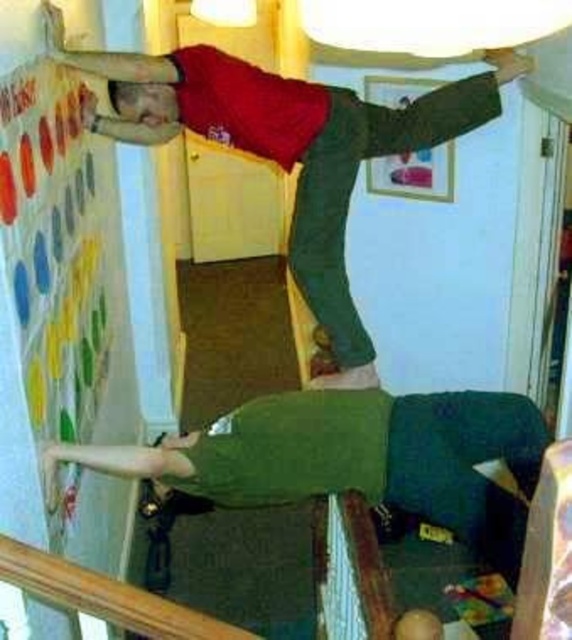
Question: Which object appears farthest from the camera in this image?

Choices:
 (A) green fabric couch at lower center
 (B) multicolored fabric bulletin board at upper left
 (C) green matte pants at upper center

Answer: (C)

Question: Can you confirm if multicolored fabric bulletin board at upper left is thinner than green fabric couch at lower center?

Choices:
 (A) no
 (B) yes

Answer: (B)

Question: Does green fabric couch at lower center appear on the left side of green matte pants at upper center?

Choices:
 (A) no
 (B) yes

Answer: (A)

Question: Which of these objects is positioned closest to the green matte pants at upper center?

Choices:
 (A) multicolored fabric bulletin board at upper left
 (B) green fabric couch at lower center

Answer: (A)

Question: Which point is farther to the camera?

Choices:
 (A) green matte pants at upper center
 (B) green fabric couch at lower center

Answer: (A)

Question: Is the position of multicolored fabric bulletin board at upper left more distant than that of green matte pants at upper center?

Choices:
 (A) no
 (B) yes

Answer: (A)